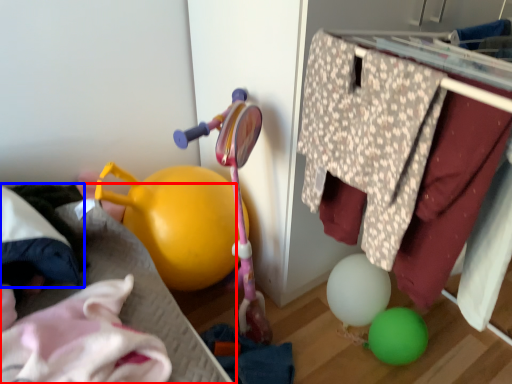
Question: Among these objects, which one is farthest to the camera, bed frame (highlighted by a red box) or clothing (highlighted by a blue box)?

Choices:
 (A) bed frame
 (B) clothing

Answer: (B)